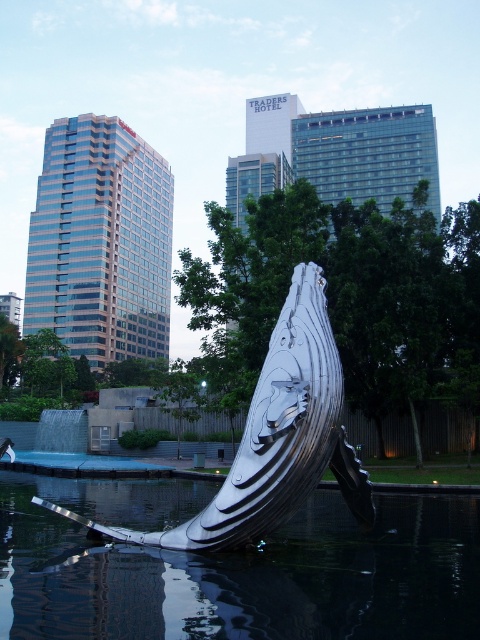
Question: Observing the image, what is the correct spatial positioning of metallic water at lower center in reference to polished silver whale at center?

Choices:
 (A) above
 (B) below

Answer: (B)

Question: Which object appears farthest from the camera in this image?

Choices:
 (A) metallic water at lower center
 (B) polished silver whale at center

Answer: (B)

Question: Can you confirm if metallic water at lower center is wider than polished silver whale at center?

Choices:
 (A) yes
 (B) no

Answer: (A)

Question: Which object appears farthest from the camera in this image?

Choices:
 (A) polished silver whale at center
 (B) metallic water at lower center

Answer: (A)

Question: Does metallic water at lower center lie in front of polished silver whale at center?

Choices:
 (A) no
 (B) yes

Answer: (B)